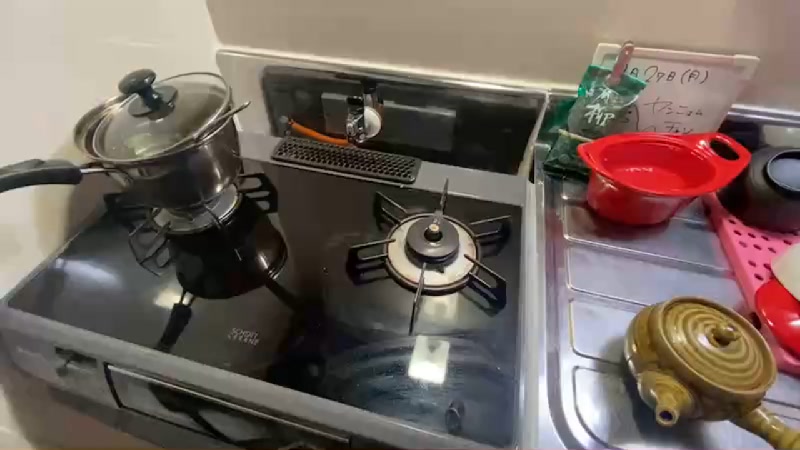
You are a GUI agent. You are given a task and a screenshot of the screen. Output one action in this format:
    pyautogui.click(x=<x>, y=<y>)
    Task: Click on the handle to grab sauce pan
    
    Given the screenshot: What is the action you would take?
    pyautogui.click(x=13, y=183)